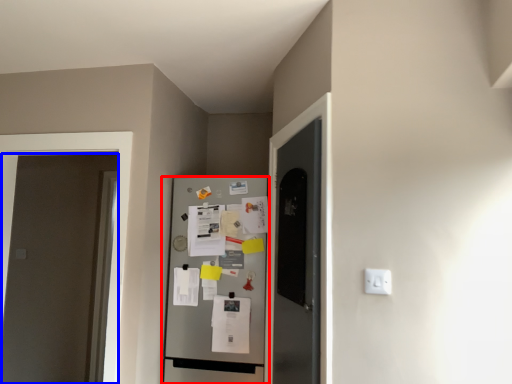
Question: Which object appears farthest to the camera in this image, refrigerator (highlighted by a red box) or door (highlighted by a blue box)?

Choices:
 (A) refrigerator
 (B) door

Answer: (A)